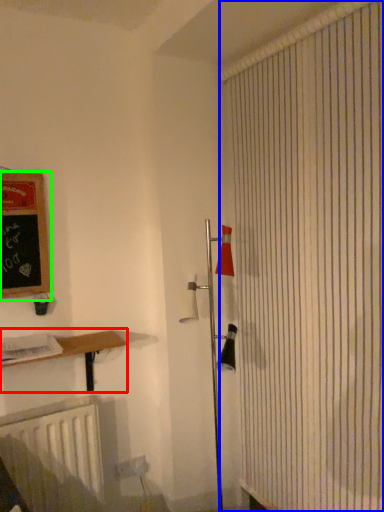
Question: Which is nearer to the shelf (highlighted by a red box)? shower curtain (highlighted by a blue box) or bulletin board (highlighted by a green box).

Choices:
 (A) shower curtain
 (B) bulletin board

Answer: (B)